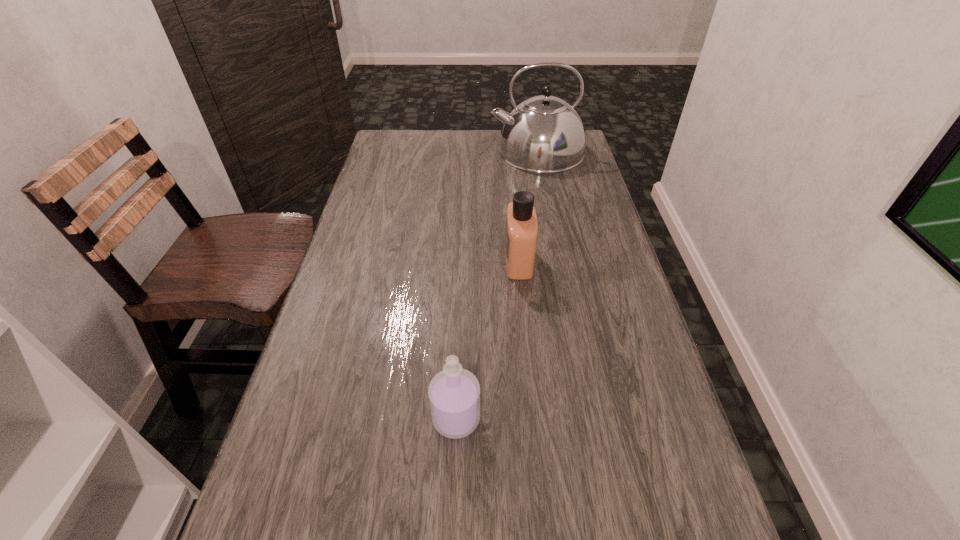
Where is `vacant space located on the front label of the farther perfume`? This screenshot has height=540, width=960. vacant space located on the front label of the farther perfume is located at coordinates (440, 261).

This screenshot has height=540, width=960. What are the coordinates of `vacant position located 0.400m on the front label of the farther perfume` in the screenshot? It's located at (350, 261).

What are the coordinates of `vacant space situated on the left of the leftmost object` in the screenshot? It's located at (373, 418).

This screenshot has width=960, height=540. Find the location of `object at the far edge`. object at the far edge is located at coordinates (544, 134).

At what (x,y) coordinates should I click in order to perform the action: click on object positioned at the right edge. Please return your answer as a coordinate pair (x, y). The image size is (960, 540). Looking at the image, I should click on (544, 134).

At what (x,y) coordinates should I click in order to perform the action: click on object at the far right corner. Please return your answer as a coordinate pair (x, y). This screenshot has width=960, height=540. Looking at the image, I should click on (544, 134).

The image size is (960, 540). In the image, there is a desktop. Identify the location of vacant area at the far edge. pos(485,153).

The width and height of the screenshot is (960, 540). In the image, there is a desktop. What are the coordinates of `vacant space at the left edge` in the screenshot? It's located at (340, 353).

Where is `vacant space at the right edge of the desktop`? This screenshot has height=540, width=960. vacant space at the right edge of the desktop is located at coordinates (654, 407).

The image size is (960, 540). I want to click on free spot between the tallest object and the left perfume, so click(x=496, y=285).